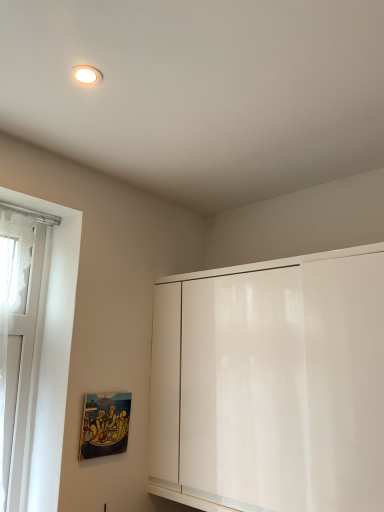
Question: Should I look upward or downward to see white glass window at left?

Choices:
 (A) up
 (B) down

Answer: (B)

Question: From the image's perspective, does white glossy cabinet at center appear lower than matte wooden picture frame at lower left?

Choices:
 (A) yes
 (B) no

Answer: (B)

Question: From a real-world perspective, is white glossy cabinet at center positioned over matte wooden picture frame at lower left based on gravity?

Choices:
 (A) no
 (B) yes

Answer: (B)

Question: Is white glossy cabinet at center not near matte wooden picture frame at lower left?

Choices:
 (A) yes
 (B) no

Answer: (B)

Question: Is white glossy cabinet at center to the left of matte wooden picture frame at lower left from the viewer's perspective?

Choices:
 (A) no
 (B) yes

Answer: (A)

Question: Is white glossy cabinet at center touching matte wooden picture frame at lower left?

Choices:
 (A) no
 (B) yes

Answer: (A)

Question: From the image's perspective, is white glossy cabinet at center above matte wooden picture frame at lower left?

Choices:
 (A) yes
 (B) no

Answer: (A)

Question: Is white glossy cabinet at center with white glass window at left?

Choices:
 (A) yes
 (B) no

Answer: (B)

Question: From a real-world perspective, is white glossy cabinet at center on top of white glass window at left?

Choices:
 (A) yes
 (B) no

Answer: (B)

Question: Is white glossy cabinet at center to the left of white glass window at left from the viewer's perspective?

Choices:
 (A) yes
 (B) no

Answer: (B)

Question: Considering the relative positions of white glossy cabinet at center and white glass window at left in the image provided, is white glossy cabinet at center to the right of white glass window at left from the viewer's perspective?

Choices:
 (A) no
 (B) yes

Answer: (B)

Question: Is white glossy cabinet at center not close to white glass window at left?

Choices:
 (A) yes
 (B) no

Answer: (B)

Question: Is white glass window at left completely or partially inside white glossy cabinet at center?

Choices:
 (A) no
 (B) yes

Answer: (A)

Question: Is white glass window at left smaller than matte wooden picture frame at lower left?

Choices:
 (A) yes
 (B) no

Answer: (B)